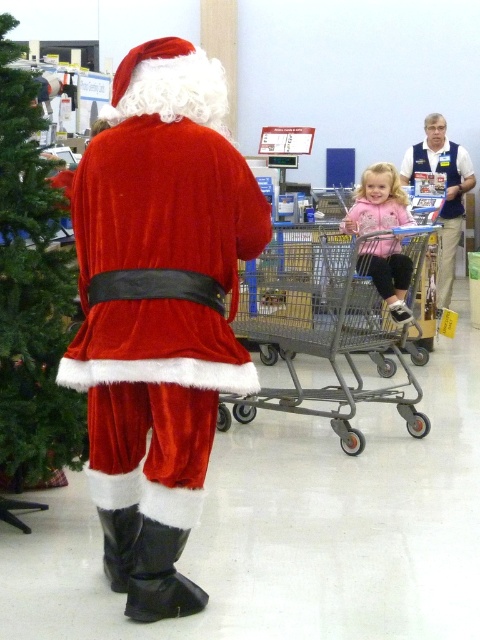
Question: Is velvet santa claus at center below green textured christmas tree at left?

Choices:
 (A) no
 (B) yes

Answer: (B)

Question: Is metallic gray shopping cart at right above blue vest at right?

Choices:
 (A) no
 (B) yes

Answer: (A)

Question: Which of the following is the farthest from the observer?

Choices:
 (A) green textured christmas tree at left
 (B) velvet santa claus at center
 (C) pink fleece jacket at center

Answer: (C)

Question: Which object is closer to the camera taking this photo?

Choices:
 (A) velvet santa claus at center
 (B) blue vest at right

Answer: (A)

Question: Which object is closer to the camera taking this photo?

Choices:
 (A) pink fleece jacket at center
 (B) green textured christmas tree at left
 (C) metallic gray shopping cart at right
 (D) velvet santa claus at center

Answer: (D)

Question: In this image, where is velvet santa claus at center located relative to blue vest at right?

Choices:
 (A) below
 (B) above

Answer: (A)